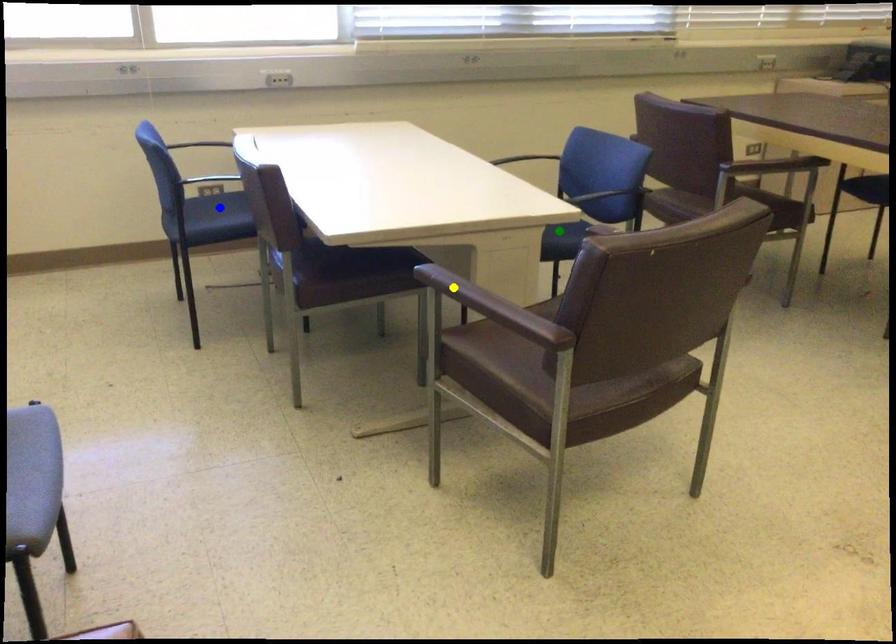
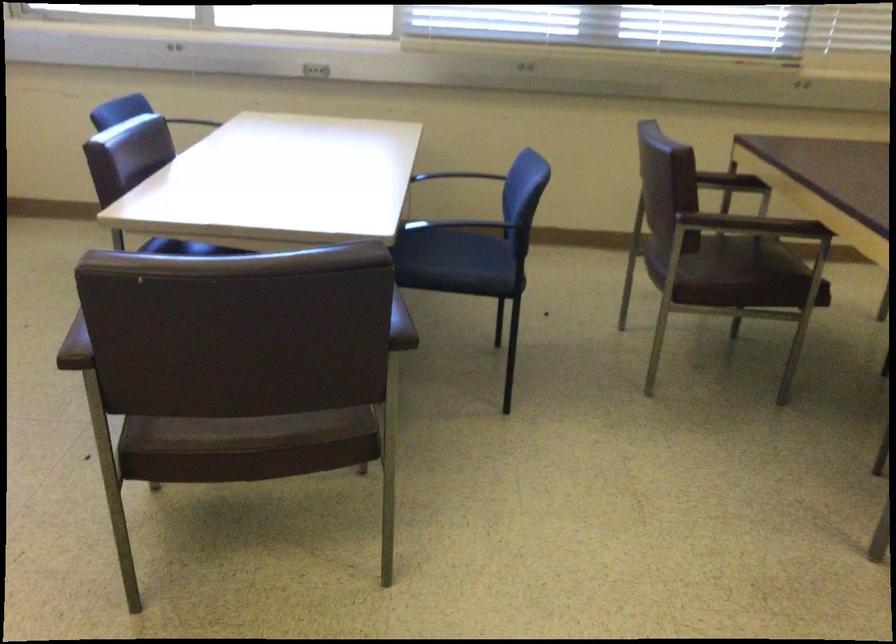
I am providing you with two images of the same scene from different viewpoints. Three points are marked in image1. Which point corresponds to a part or object that is occluded in image2?In image1, three points are marked. Which of them correspond to a part or object that is occluded in image2?Among the three points shown in image1, which one corresponds to a part or object that is no longer visible due to occlusion in image2?

Invisible in image2: blue point, yellow point.